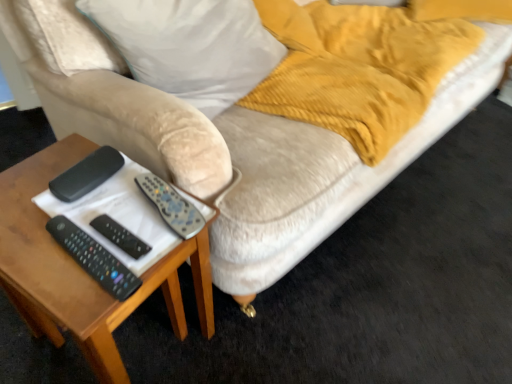
Locate an element on the screen. This screenshot has width=512, height=384. free region on the left part of black plastic remote at center, arranged as the 2th remote when ordered from the bottom is located at coordinates coord(39,234).